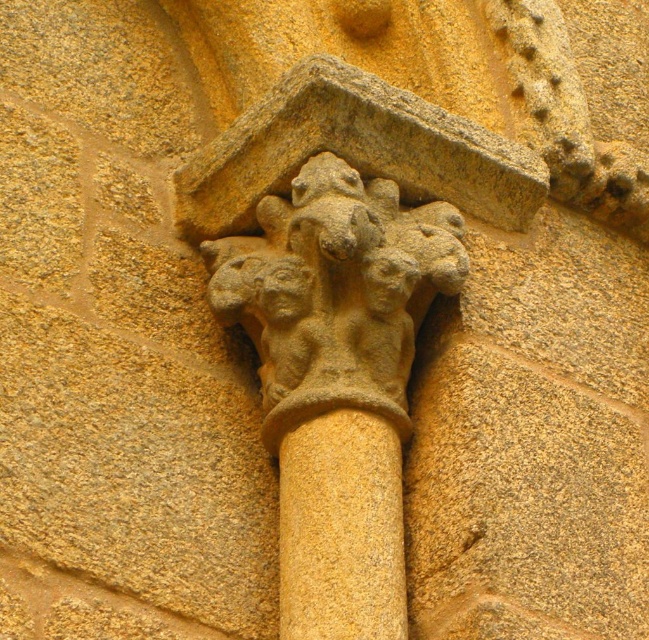
Question: Is stone carved figures at upper center bigger than yellow stone column at center?

Choices:
 (A) yes
 (B) no

Answer: (A)

Question: Which point is closer to the camera?

Choices:
 (A) yellow stone column at center
 (B) stone carved figures at upper center

Answer: (A)

Question: Is stone carved figures at upper center below yellow stone column at center?

Choices:
 (A) yes
 (B) no

Answer: (B)

Question: Observing the image, what is the correct spatial positioning of stone carved figures at upper center in reference to yellow stone column at center?

Choices:
 (A) right
 (B) left

Answer: (B)

Question: Which of the following is the farthest from the observer?

Choices:
 (A) yellow stone column at center
 (B) stone carved figures at upper center

Answer: (B)